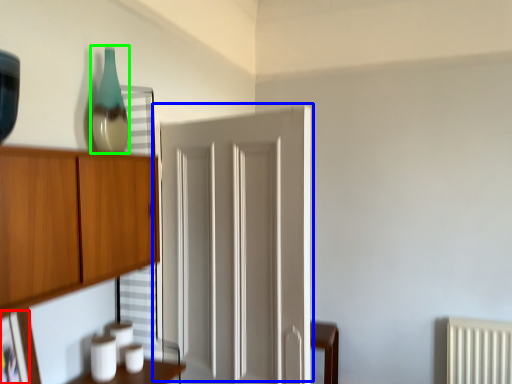
Question: Which object is the closest to the picture frame (highlighted by a red box)? Choose among these: door (highlighted by a blue box) or glass vase (highlighted by a green box).

Choices:
 (A) door
 (B) glass vase

Answer: (B)